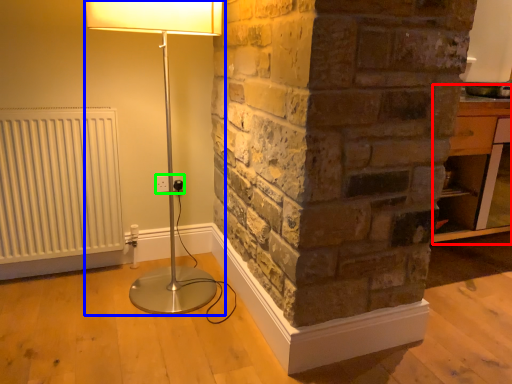
Question: Considering the real-world distances, which object is closest to table (highlighted by a red box)? lamp (highlighted by a blue box) or electric outlet (highlighted by a green box).

Choices:
 (A) lamp
 (B) electric outlet

Answer: (A)